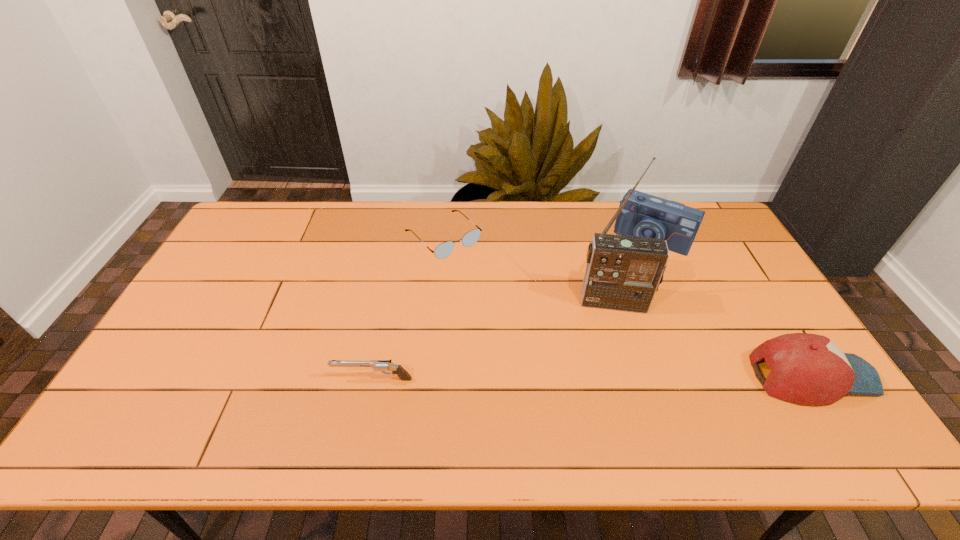
The width and height of the screenshot is (960, 540). I want to click on vacant space in between the fourth tallest object and the third farthest object, so click(x=493, y=341).

Locate an element on the screen. This screenshot has width=960, height=540. unoccupied area between the third shortest object and the fourth tallest object is located at coordinates (592, 377).

Where is `empty space between the camera and the third tallest object`? This screenshot has height=540, width=960. empty space between the camera and the third tallest object is located at coordinates (732, 308).

What are the coordinates of `free point between the fourth shortest object and the pistol` in the screenshot? It's located at (513, 309).

Identify the location of empty location between the third shortest object and the radio receiver. (713, 339).

Image resolution: width=960 pixels, height=540 pixels. Find the location of `free space between the pistol and the third shortest object`. free space between the pistol and the third shortest object is located at coordinates (592, 377).

The width and height of the screenshot is (960, 540). Find the location of `unoccupied area between the radio receiver and the third shortest object`. unoccupied area between the radio receiver and the third shortest object is located at coordinates (713, 339).

In order to click on vacant region between the third tallest object and the camera in this screenshot , I will do `click(732, 308)`.

Find the location of a particular element. vacant space in between the shortest object and the third nearest object is located at coordinates (529, 270).

Select which object appears as the fourth closest to the tallest object. Please provide its 2D coordinates. Your answer should be formatted as a tuple, i.e. [(x, y)], where the tuple contains the x and y coordinates of a point satisfying the conditions above.

[(378, 365)]